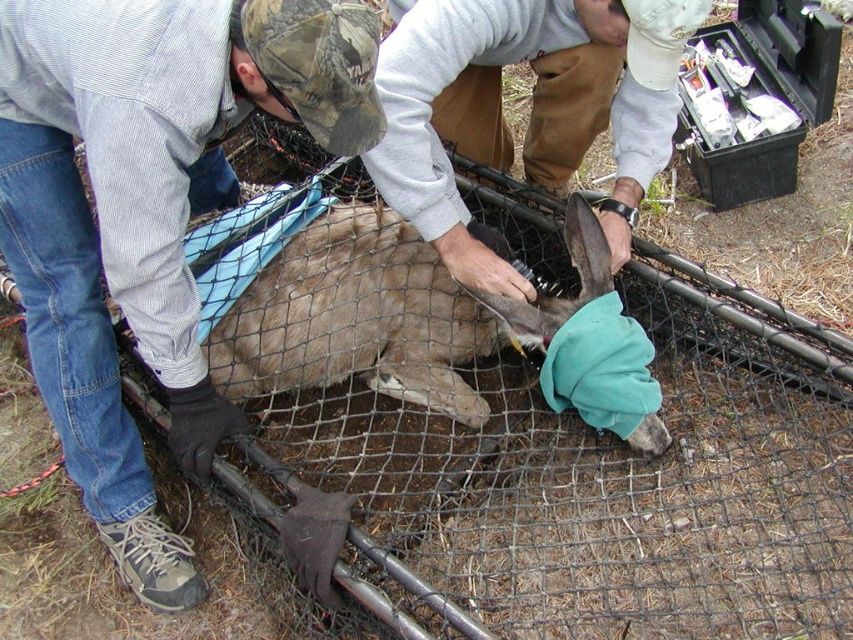
From the picture: Is the position of camouflage hat at upper left more distant than that of brown fur at center?

No, camouflage hat at upper left is in front of brown fur at center.

Is the position of camouflage hat at upper left less distant than that of brown fur at center?

Yes, camouflage hat at upper left is closer to the viewer.

The width and height of the screenshot is (853, 640). What do you see at coordinates (148, 212) in the screenshot?
I see `camouflage hat at upper left` at bounding box center [148, 212].

Image resolution: width=853 pixels, height=640 pixels. I want to click on camouflage hat at upper left, so click(x=148, y=212).

Does camouflage hat at upper left have a larger size compared to brown leather glove at center?

Indeed, camouflage hat at upper left has a larger size compared to brown leather glove at center.

Can you confirm if camouflage hat at upper left is positioned to the left of brown leather glove at center?

Indeed, camouflage hat at upper left is positioned on the left side of brown leather glove at center.

Locate an element on the screen. This screenshot has height=640, width=853. camouflage hat at upper left is located at coordinates (148, 212).

Which is in front, point (601, 216) or point (328, 253)?

Positioned in front is point (328, 253).

Can you confirm if brown leather glove at center is thinner than brown fur at center?

Indeed, brown leather glove at center has a lesser width compared to brown fur at center.

Describe the element at coordinates (531, 113) in the screenshot. The image size is (853, 640). I see `brown leather glove at center` at that location.

This screenshot has width=853, height=640. What are the coordinates of `brown leather glove at center` in the screenshot? It's located at (531, 113).